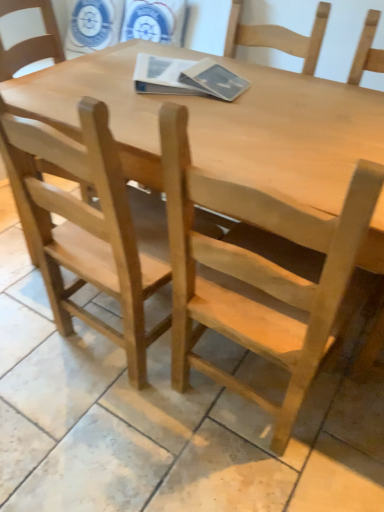
Find the location of a particular element. The width and height of the screenshot is (384, 512). free region under natural wood chair at center, the second chair from the left (from a real-world perspective) is located at coordinates (230, 408).